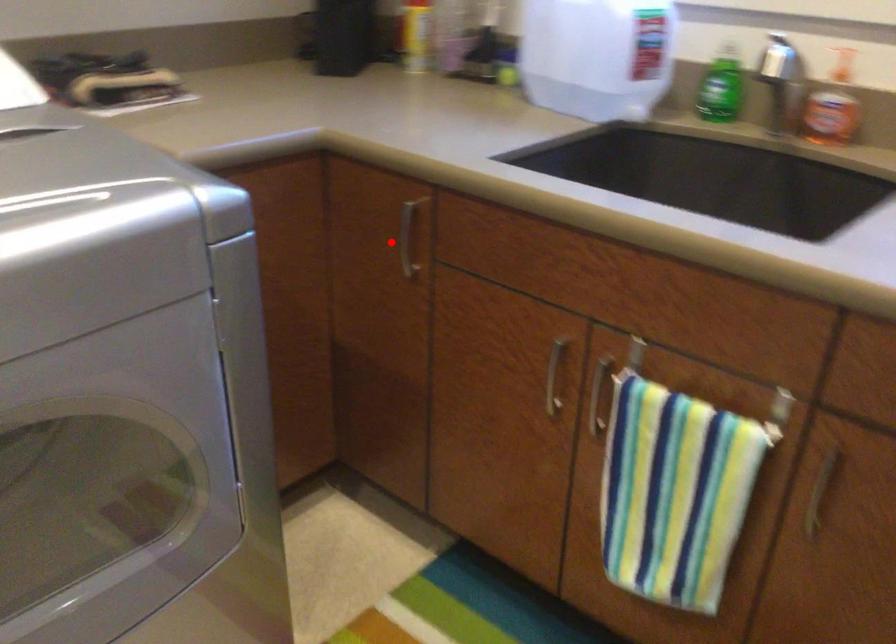
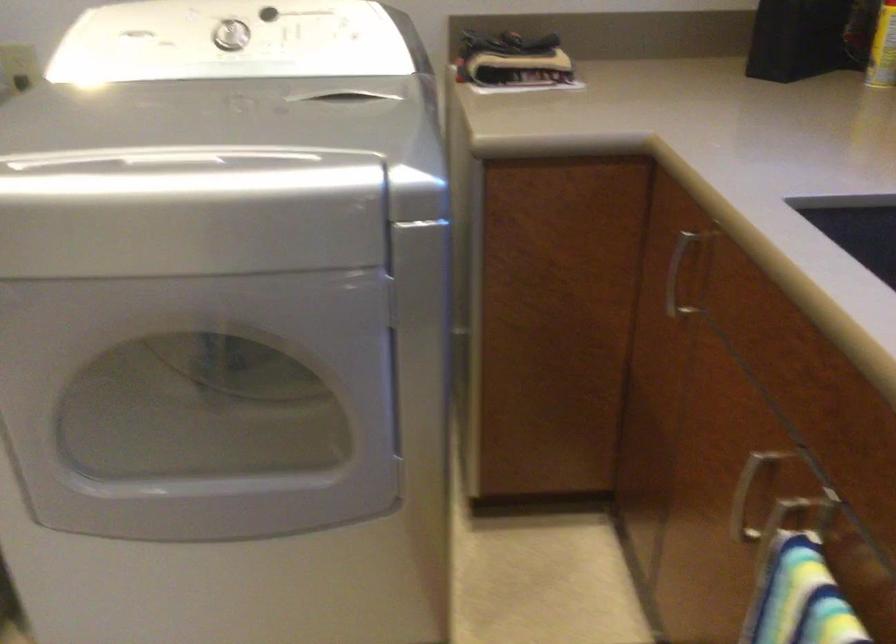
Question: A red point is marked in image1. In image2, is the corresponding 3D point closer to the camera or farther? Reply with the corresponding letter.

Choices:
 (A) The corresponding 3D point is closer.
 (B) The corresponding 3D point is farther.

Answer: (A)